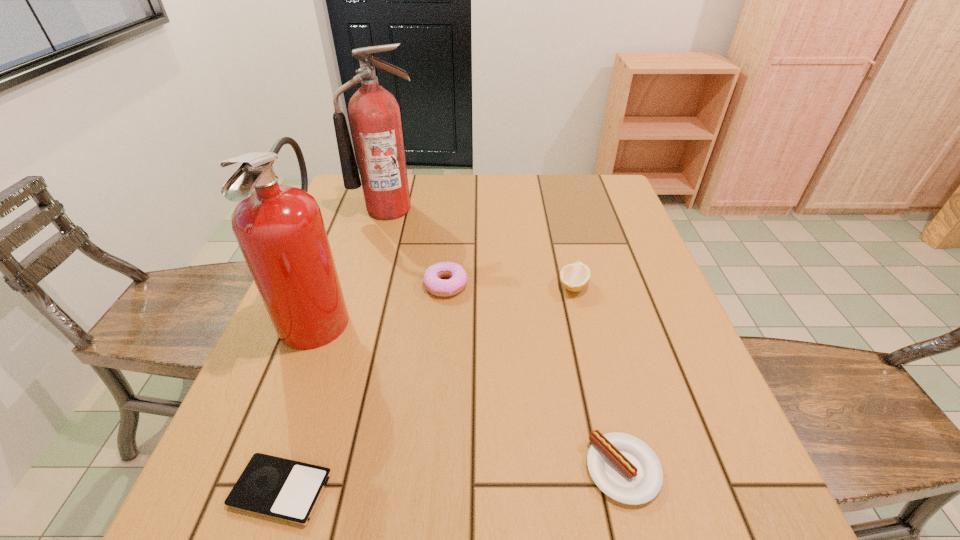
What are the coordinates of `vacant space that satisfies the following two spatial constraints: 1. on the front side of the lemon; 2. on the right side of the sausage` in the screenshot? It's located at (617, 470).

Where is `vacant area in the image that satisfies the following two spatial constraints: 1. with the handle and nozzle on the shortest object; 2. on the left side of the nearer fire extinguisher`? This screenshot has width=960, height=540. vacant area in the image that satisfies the following two spatial constraints: 1. with the handle and nozzle on the shortest object; 2. on the left side of the nearer fire extinguisher is located at coordinates (250, 490).

You are a GUI agent. You are given a task and a screenshot of the screen. Output one action in this format:
    pyautogui.click(x=<x>, y=<y>)
    Task: Click on the blank space that satisfies the following two spatial constraints: 1. on the front of the farther fire extinguisher near the operation label; 2. with the handle and nozzle on the nearer fire extinguisher
    The width and height of the screenshot is (960, 540).
    Given the screenshot: What is the action you would take?
    pyautogui.click(x=358, y=312)

This screenshot has width=960, height=540. Find the location of `free space that satisfies the following two spatial constraints: 1. with the handle and nozzle on the nearer fire extinguisher; 2. on the left side of the iPod`. free space that satisfies the following two spatial constraints: 1. with the handle and nozzle on the nearer fire extinguisher; 2. on the left side of the iPod is located at coordinates (250, 490).